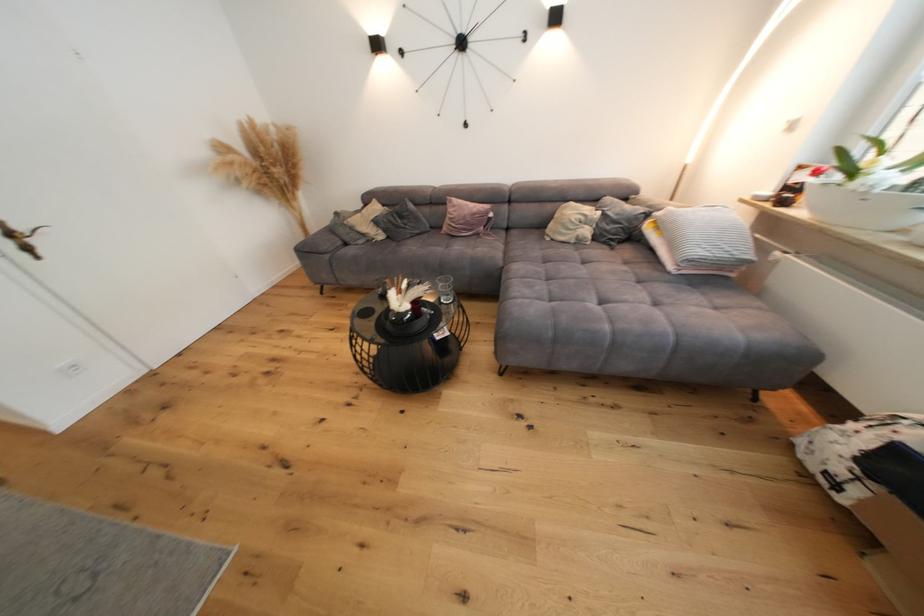
Where would you lift the white plant pot? Please return your answer as a coordinate pair (x, y).

(861, 206)